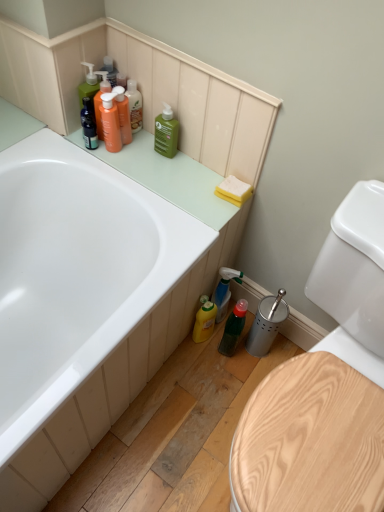
Locate an element on the screen. vacant area located to the right-hand side of translucent orange bottle at upper left, acting as the 4th cleaning product starting from the bottom is located at coordinates (168, 155).